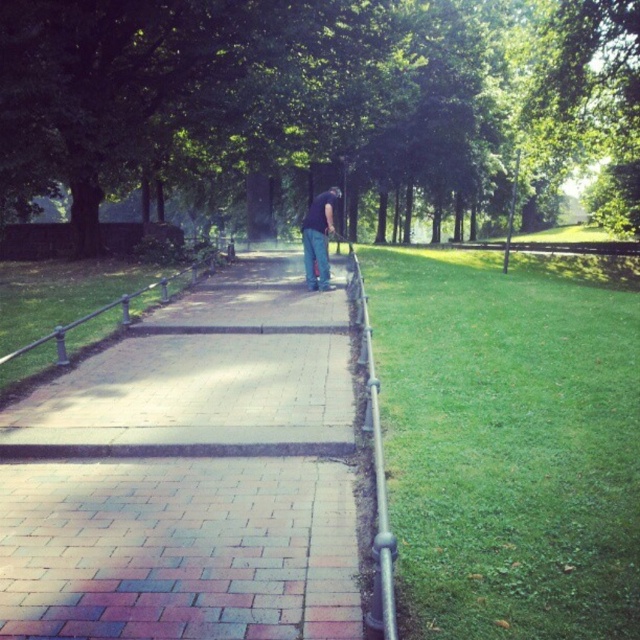
Does green leafy tree at center appear on the left side of silver metallic rail at right?

Incorrect, green leafy tree at center is not on the left side of silver metallic rail at right.

Is green leafy tree at center below silver metallic rail at right?

Actually, green leafy tree at center is above silver metallic rail at right.

Who is more forward, (435, 192) or (364, 376)?

Point (364, 376) is more forward.

You are a GUI agent. You are given a task and a screenshot of the screen. Output one action in this format:
    pyautogui.click(x=<x>, y=<y>)
    Task: Click on the green leafy tree at center
    The width and height of the screenshot is (640, 640).
    Given the screenshot: What is the action you would take?
    pyautogui.click(x=321, y=108)

Which is below, green leafy tree at center or green grass at right?

Positioned lower is green grass at right.

Find the location of a particular element. This screenshot has width=640, height=640. green leafy tree at center is located at coordinates 321,108.

Which is behind, point (36, 156) or point (419, 320)?

The point (36, 156) is behind.

Locate an element on the screen. green leafy tree at center is located at coordinates (321, 108).

Locate an element on the screen. The width and height of the screenshot is (640, 640). green grass at right is located at coordinates (509, 440).

Who is more forward, (532, 371) or (362, 330)?

Point (532, 371) is more forward.

At what (x,y) coordinates should I click in order to perform the action: click on green grass at right. Please return your answer as a coordinate pair (x, y). Looking at the image, I should click on (509, 440).